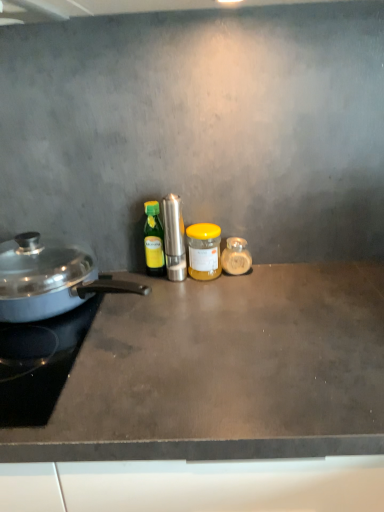
Image resolution: width=384 pixels, height=512 pixels. I want to click on free space to the right of shiny silver pan at left, placed as the 1th kitchen appliance when sorted from left to right, so click(x=239, y=321).